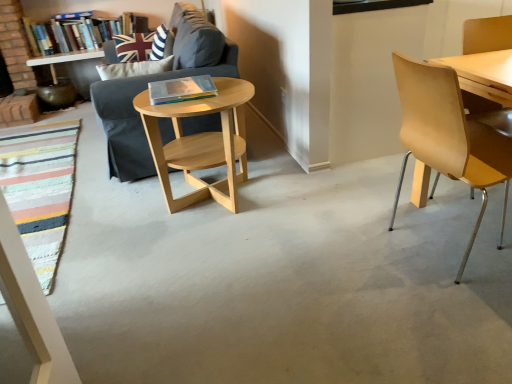
Question: Is hardcover book at center, acting as the 2th book starting from the top, further to the viewer compared to light wood/woodenobject at center?

Choices:
 (A) yes
 (B) no

Answer: (A)

Question: Does hardcover book at center, which is the 1th book from front to back, have a lesser width compared to light wood/woodenobject at center?

Choices:
 (A) yes
 (B) no

Answer: (A)

Question: Can you confirm if hardcover book at center, which is the 1th book from front to back, is positioned to the right of light wood/woodenobject at center?

Choices:
 (A) no
 (B) yes

Answer: (A)

Question: Is hardcover book at center, arranged as the 1th book when viewed from the right, not inside light wood/woodenobject at center?

Choices:
 (A) no
 (B) yes

Answer: (B)

Question: From a real-world perspective, does hardcover book at center, arranged as the 1th book when viewed from the right, sit lower than light wood/woodenobject at center?

Choices:
 (A) yes
 (B) no

Answer: (B)

Question: Is hardcover book at center, marked as the second book in a left-to-right arrangement, not near light wood/woodenobject at center?

Choices:
 (A) no
 (B) yes

Answer: (A)

Question: Is hardcover book at center, arranged as the 1th book when viewed from the right, with dark gray fabric couch at center-left?

Choices:
 (A) yes
 (B) no

Answer: (B)

Question: Is hardcover book at center, arranged as the 1th book when viewed from the right, shorter than dark gray fabric couch at center-left?

Choices:
 (A) no
 (B) yes

Answer: (B)

Question: From a real-world perspective, is hardcover book at center, which is the 1th book from front to back, on dark gray fabric couch at center-left?

Choices:
 (A) no
 (B) yes

Answer: (B)

Question: Is hardcover book at center, arranged as the 1th book when viewed from the right, not near dark gray fabric couch at center-left?

Choices:
 (A) no
 (B) yes

Answer: (A)

Question: Is hardcover book at center, acting as the 2th book starting from the top, smaller than dark gray fabric couch at center-left?

Choices:
 (A) yes
 (B) no

Answer: (A)

Question: Is hardcover book at center, which is the 1th book from front to back, thinner than dark gray fabric couch at center-left?

Choices:
 (A) yes
 (B) no

Answer: (A)

Question: Can you confirm if dark gray fabric couch at center-left is thinner than light wood/woodenobject at center?

Choices:
 (A) no
 (B) yes

Answer: (A)